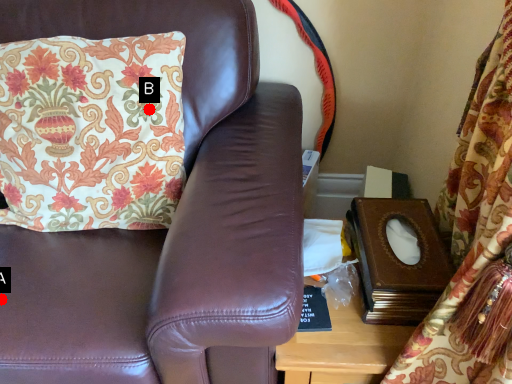
Question: Two points are circled on the image, labeled by A and B beside each circle. Among these points, which one is farthest from the camera?

Choices:
 (A) A is further
 (B) B is further

Answer: (B)